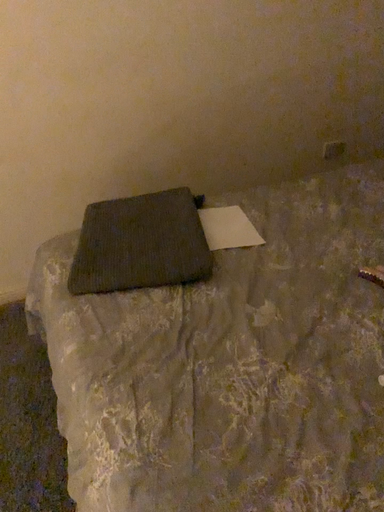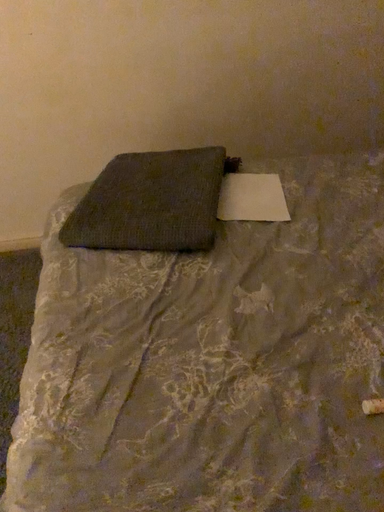
Question: Which way did the camera rotate in the video?

Choices:
 (A) rotated left
 (B) rotated right

Answer: (A)